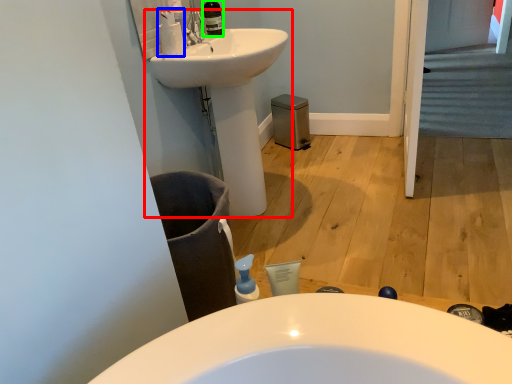
Question: Considering the real-world distances, which object is farthest from sink (highlighted by a red box)? cleaning product (highlighted by a blue box) or toiletry (highlighted by a green box)?

Choices:
 (A) cleaning product
 (B) toiletry

Answer: (A)